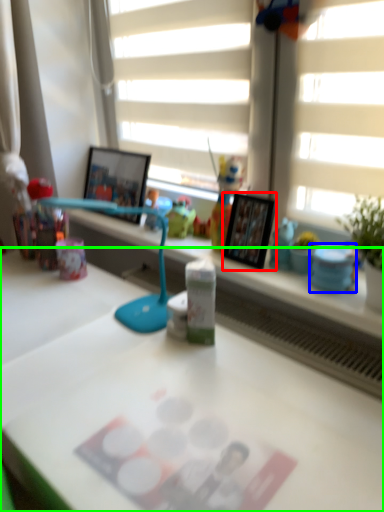
Question: Estimate the real-world distances between objects in this image. Which object is farther from picture frame (highlighted by a red box), stationery (highlighted by a blue box) or desk (highlighted by a green box)?

Choices:
 (A) stationery
 (B) desk

Answer: (B)